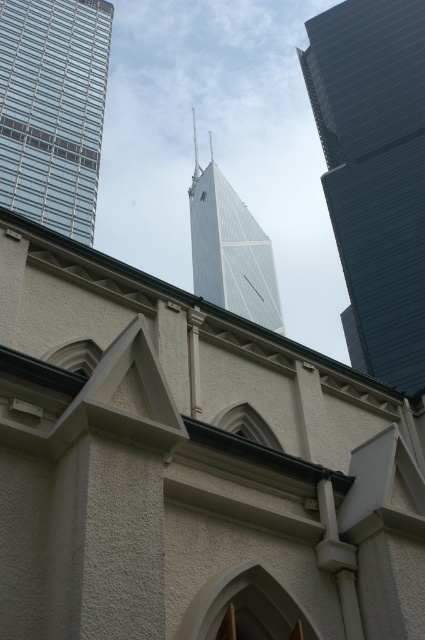
In the scene shown: You are an architect analyzing the layout of the cityscape. You notice two prominent structures, the dark blue glass skyscraper at right and the smooth glass spire at center. Which one is positioned to the right of the other?

The dark blue glass skyscraper at right is positioned to the right of the smooth glass spire at center.

You are an architect analyzing the spatial relationship between the dark blue glass skyscraper at right and the smooth glass spire at center. Based on the scene, which object appears lower in the image?

The dark blue glass skyscraper at right is below the smooth glass spire at center, so it appears lower in the image.